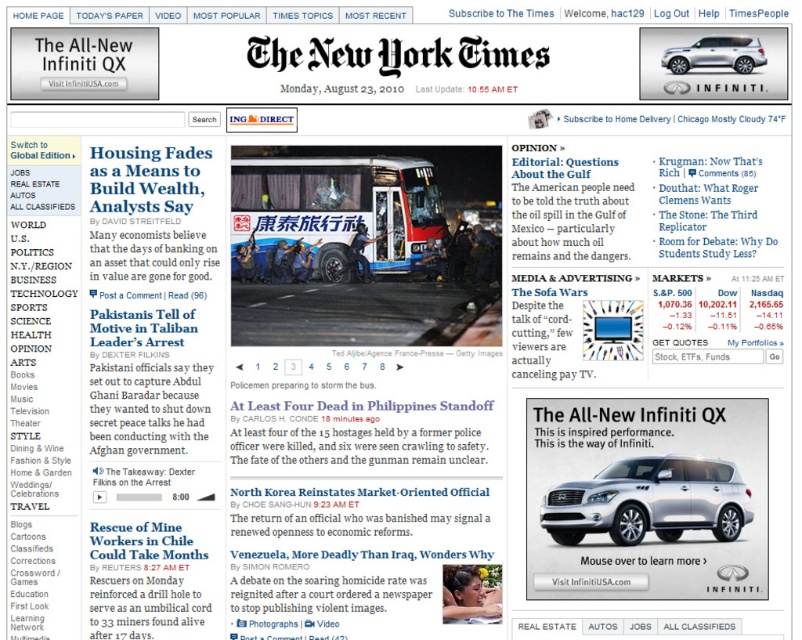
You are a delivery driver who needs to park your vehicle in a space that can accommodate both the silver metallic suv at center and the satin silver suv at upper right. The parking space is 10 meters long. Can both vehicles fit side by side in this space?

The silver metallic suv at center is 8.39 meters away from the satin silver suv at upper right. Since the parking space is 10 meters long, both vehicles can fit side by side as the total distance between them is less than the available space.

You are a delivery driver trying to navigate to the silver metallic suv at center on the New York Times homepage screenshot. According to the coordinates provided, where exactly is the silver metallic suv positioned?

The silver metallic suv at center is located at point coordinates of (x=649, y=500).

You are a delivery driver who needs to park your vehicle in the parking lot shown in the image. You see a silver metallic suv at center and a satin silver suv at upper right. Which vehicle is located lower on the page?

The silver metallic suv at center is positioned under the satin silver suv at upper right, so it is located lower on the page.